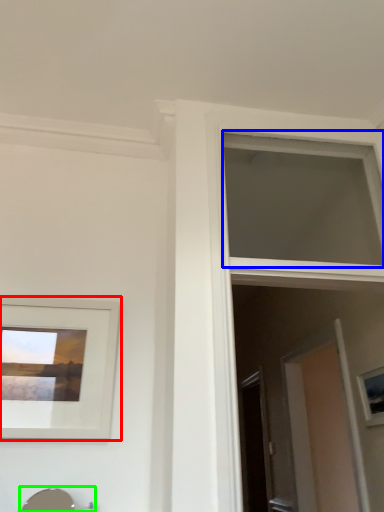
Question: Based on their relative distances, which object is nearer to picture frame (highlighted by a red box)? Choose from window (highlighted by a blue box) and sink (highlighted by a green box).

Choices:
 (A) window
 (B) sink

Answer: (B)